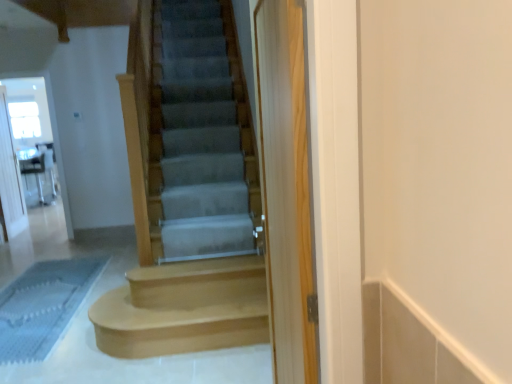
Question: In the image, is light brown wood stairs at center, which is the second stairs from front to back, positioned in front of or behind clear glass screen door at left, acting as the first screen door starting from the left?

Choices:
 (A) front
 (B) behind

Answer: (A)

Question: Considering the positions of point (202, 306) and point (10, 190), is point (202, 306) closer or farther from the camera than point (10, 190)?

Choices:
 (A) closer
 (B) farther

Answer: (A)

Question: Which is farther from the smooth gray carpet at center, positioned as the second stairs in bottom-to-top order?

Choices:
 (A) clear glass screen door at upper left, acting as the second screen door starting from the right
 (B) blue textured bath mat at lower left
 (C) light brown wood stairs at center, which is the second stairs from front to back
 (D) clear glass screen door at left, acting as the 3th screen door starting from the front
 (E) clear wood screen door at center, positioned as the 1th screen door in front-to-back order

Answer: (A)

Question: Which of these objects is positioned farthest from the blue textured bath mat at lower left?

Choices:
 (A) clear wood screen door at center, arranged as the third screen door when viewed from the back
 (B) light brown wood stairs at center, which is counted as the second stairs, starting from the top
 (C) clear glass screen door at upper left, the second screen door viewed from the front
 (D) smooth gray carpet at center, which appears as the 2th stairs when viewed from the back
 (E) clear glass screen door at left, acting as the 3th screen door starting from the front

Answer: (A)